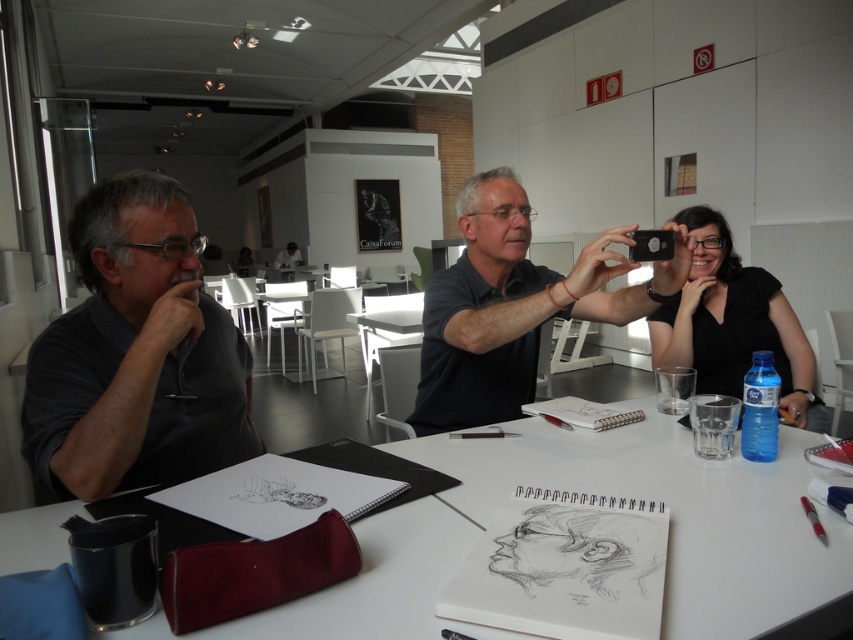
Question: Is dark gray shirt at left bigger than black matte shirt at upper right?

Choices:
 (A) yes
 (B) no

Answer: (B)

Question: Which object is farther from the camera taking this photo?

Choices:
 (A) white paper at center
 (B) dark gray shirt at left
 (C) matte black phone at center

Answer: (C)

Question: Which object is the closest to the dark gray shirt at left?

Choices:
 (A) black matte shirt at upper right
 (B) white paper at center

Answer: (B)

Question: Is white paper at center in front of black matte shirt at upper right?

Choices:
 (A) no
 (B) yes

Answer: (B)

Question: Estimate the real-world distances between objects in this image. Which object is farther from the matte black phone at center?

Choices:
 (A) black matte shirt at upper right
 (B) white paper at center
 (C) dark gray shirt at left

Answer: (C)

Question: Is matte black phone at center above black matte shirt at upper right?

Choices:
 (A) yes
 (B) no

Answer: (A)